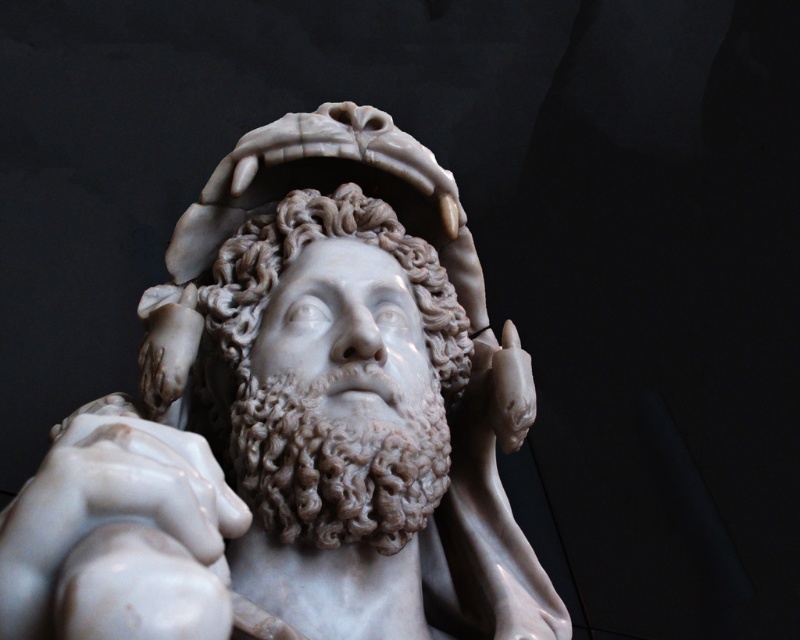
Question: Which object appears farthest from the camera in this image?

Choices:
 (A) white marble head at center
 (B) white marble statue at center

Answer: (A)

Question: Does white marble statue at center appear over white marble head at center?

Choices:
 (A) yes
 (B) no

Answer: (B)

Question: Is white marble statue at center thinner than white marble head at center?

Choices:
 (A) no
 (B) yes

Answer: (A)

Question: Is white marble statue at center wider than white marble head at center?

Choices:
 (A) yes
 (B) no

Answer: (A)

Question: Which object appears farthest from the camera in this image?

Choices:
 (A) white marble head at center
 (B) white marble statue at center

Answer: (A)